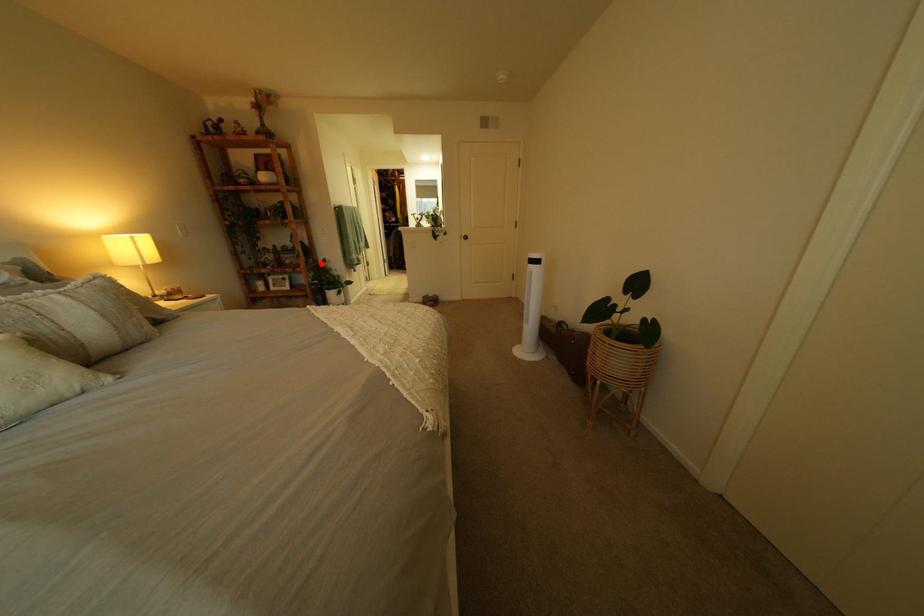
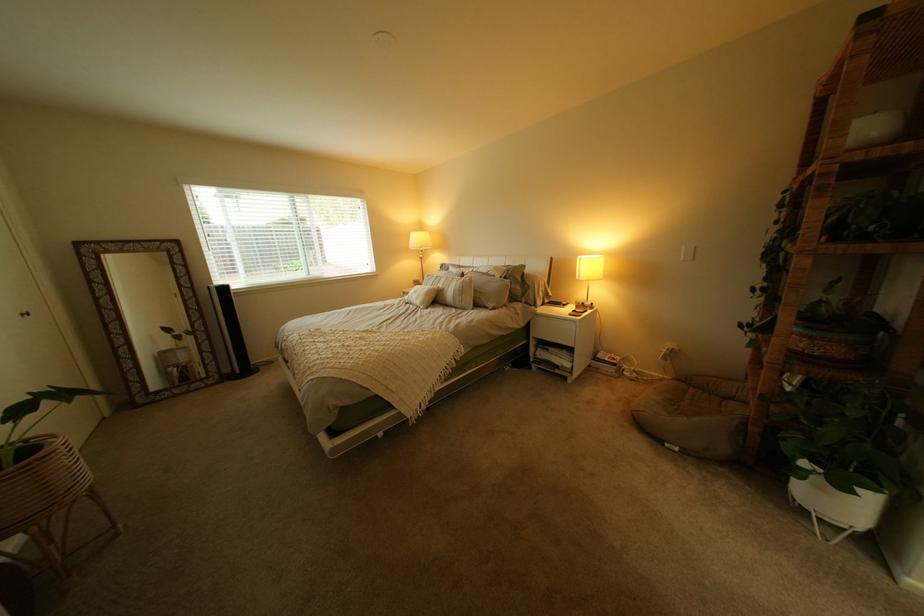
Locate, in the second image, the point that corresponds to the highlighted location in the first image.

(805, 354)